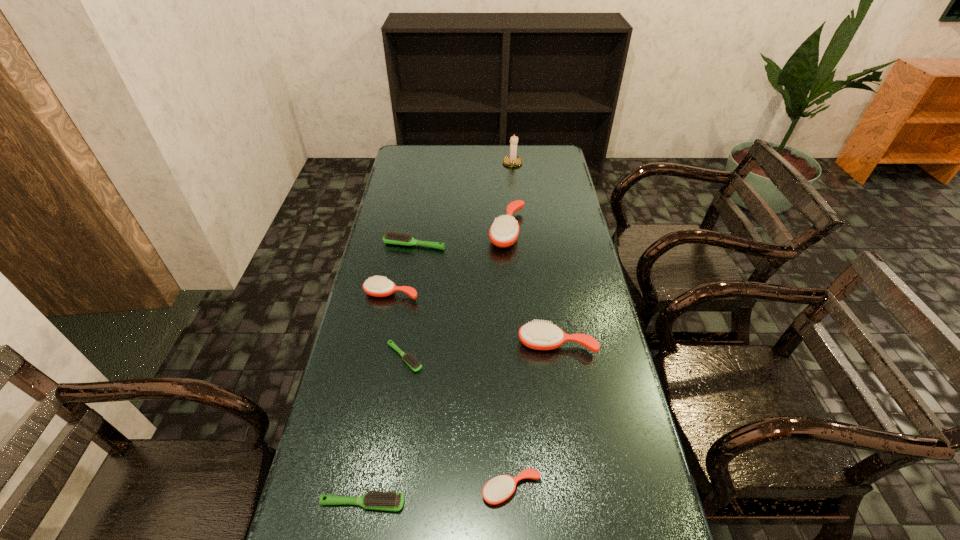
The width and height of the screenshot is (960, 540). What are the coordinates of `free space between the biggest light hairbrush and the second farthest light hairbrush` in the screenshot? It's located at (410, 301).

Locate an element on the screen. unoccupied position between the shortest hairbrush and the third farthest hairbrush is located at coordinates (398, 326).

The width and height of the screenshot is (960, 540). Find the location of `vacant space that's between the leftmost orange hairbrush and the biggest orange hairbrush`. vacant space that's between the leftmost orange hairbrush and the biggest orange hairbrush is located at coordinates (449, 262).

Where is `vacant area between the second smallest light hairbrush and the sixth shortest object`? vacant area between the second smallest light hairbrush and the sixth shortest object is located at coordinates (460, 424).

Locate an element on the screen. The image size is (960, 540). unoccupied area between the sixth shortest object and the biggest orange hairbrush is located at coordinates (532, 287).

I want to click on unoccupied position between the smallest light hairbrush and the second biggest light hairbrush, so click(384, 431).

Locate an element on the screen. free spot between the smallest light hairbrush and the white candle holder is located at coordinates (459, 260).

Point out which object is positioned as the sixth nearest to the tallest object. Please provide its 2D coordinates. Your answer should be formatted as a tuple, i.e. [(x, y)], where the tuple contains the x and y coordinates of a point satisfying the conditions above.

[(498, 489)]

Identify which object is located as the seventh nearest to the smallest orange hairbrush. Please provide its 2D coordinates. Your answer should be formatted as a tuple, i.e. [(x, y)], where the tuple contains the x and y coordinates of a point satisfying the conditions above.

[(512, 160)]

Where is `hairbrush object that ranks as the third closest to the farthest light hairbrush`? The image size is (960, 540). hairbrush object that ranks as the third closest to the farthest light hairbrush is located at coordinates [415, 365].